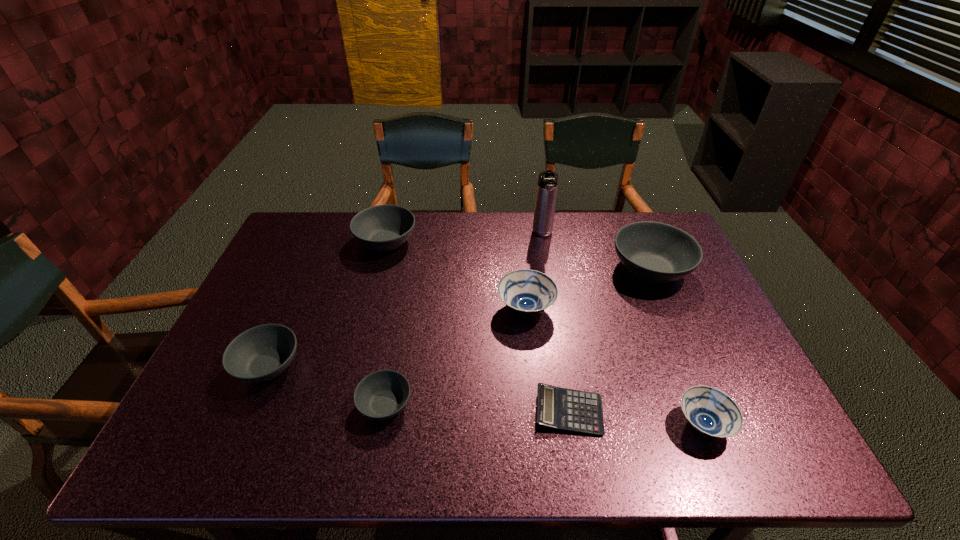
At what (x,y) coordinates should I click in order to perform the action: click on free space that satisfies the following two spatial constraints: 1. on the back side of the third smallest gray soup bowl; 2. on the left side of the second smallest gray soup bowl. Please return your answer as a coordinate pair (x, y). The image size is (960, 540). Looking at the image, I should click on (323, 241).